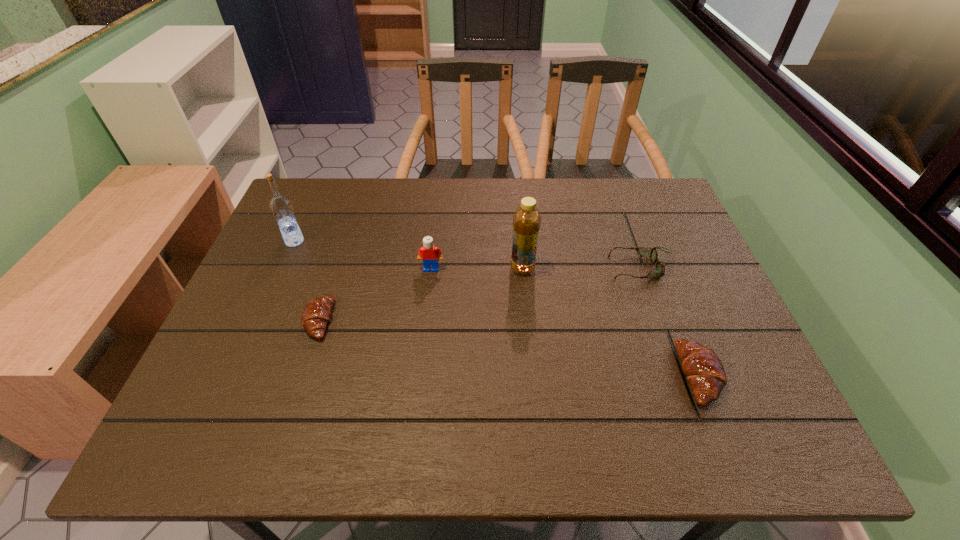
Find the location of a particular element. Image resolution: width=960 pixels, height=540 pixels. the farther crescent roll is located at coordinates (317, 313).

Where is `the shorter crescent roll`? The height and width of the screenshot is (540, 960). the shorter crescent roll is located at coordinates (317, 313).

The height and width of the screenshot is (540, 960). In order to click on the right crescent roll in this screenshot , I will do `click(702, 367)`.

I want to click on the nearer crescent roll, so pos(702,367).

You are a GUI agent. You are given a task and a screenshot of the screen. Output one action in this format:
    pyautogui.click(x=<x>, y=<y>)
    Task: Click on the vodka
    This screenshot has height=540, width=960.
    Given the screenshot: What is the action you would take?
    pyautogui.click(x=281, y=207)

You are a GUI agent. You are given a task and a screenshot of the screen. Output one action in this format:
    pyautogui.click(x=<x>, y=<y>)
    Task: Click on the farthest object
    
    Given the screenshot: What is the action you would take?
    pyautogui.click(x=281, y=207)

Where is `spectacles`? The image size is (960, 540). spectacles is located at coordinates pos(659,270).

Find the location of a particular element. The height and width of the screenshot is (540, 960). bottle is located at coordinates (527, 220).

Where is `the third tallest object`? The height and width of the screenshot is (540, 960). the third tallest object is located at coordinates (430, 254).

Where is `Lego`? The width and height of the screenshot is (960, 540). Lego is located at coordinates (430, 254).